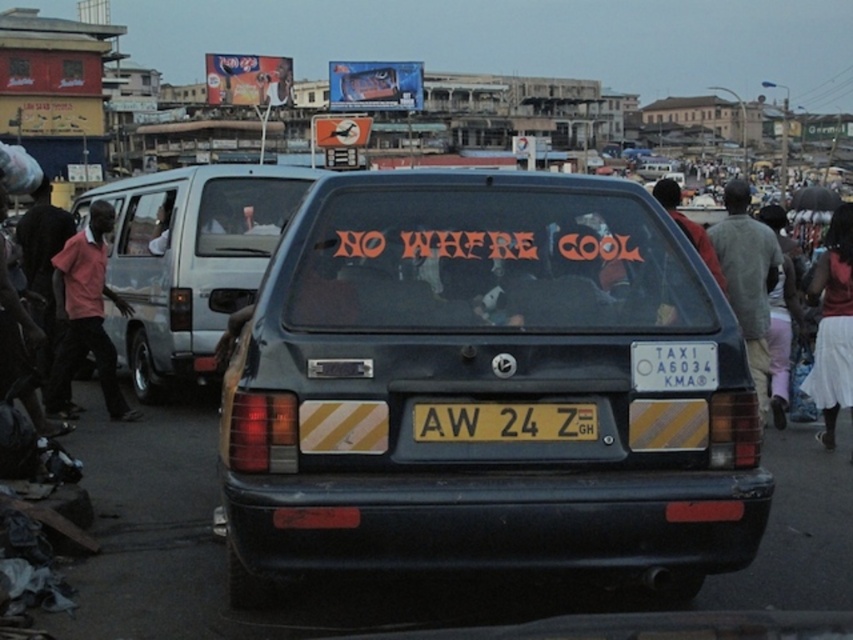
Between point (262, 218) and point (846, 264), which one is positioned in front?

Positioned in front is point (846, 264).

Who is more distant from viewer, (276,212) or (816,260)?

Positioned behind is point (816,260).

In order to click on matte black van at center in this screenshot , I will do `click(189, 259)`.

Is the position of pink fabric shirt at left more distant than that of yellow matte license plate at center?

Yes, pink fabric shirt at left is further from the viewer.

Does point (86, 278) come closer to viewer compared to point (422, 403)?

No, it is behind (422, 403).

Which is in front, point (74, 349) or point (433, 403)?

Point (433, 403) is more forward.

At what (x,y) coordinates should I click in order to perform the action: click on pink fabric shirt at left. Please return your answer as a coordinate pair (x, y). Looking at the image, I should click on (85, 314).

Is matte black car at center thinner than yellow matte license plate at center?

In fact, matte black car at center might be wider than yellow matte license plate at center.

Does matte black car at center have a greater height compared to yellow matte license plate at center?

Indeed, matte black car at center has a greater height compared to yellow matte license plate at center.

Is point (525, 257) more distant than point (590, 436)?

Yes, it is behind point (590, 436).

Find the location of a particular element. The height and width of the screenshot is (640, 853). matte black car at center is located at coordinates (486, 387).